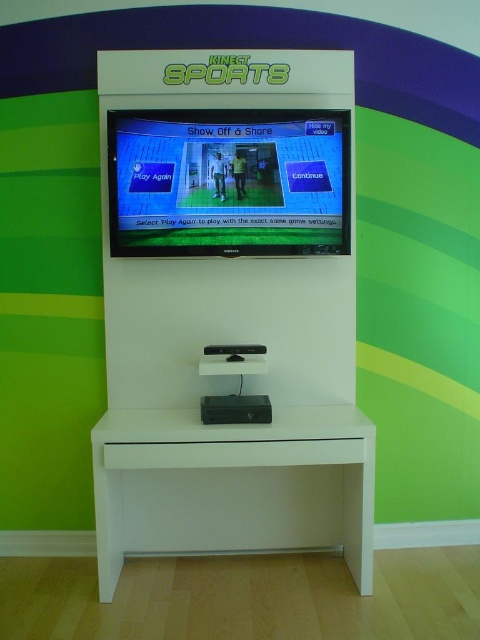
The width and height of the screenshot is (480, 640). In order to click on white glossy entertainment center at center in this screenshot , I will do `click(229, 308)`.

Can you confirm if white glossy entertainment center at center is wider than white matte table at center?

No, white glossy entertainment center at center is not wider than white matte table at center.

Find the location of `white glossy entertainment center at center`. white glossy entertainment center at center is located at coordinates (229, 308).

The height and width of the screenshot is (640, 480). What are the coordinates of `white glossy entertainment center at center` in the screenshot? It's located at (229, 308).

Does white matte table at center have a smaller size compared to matte black screen at center?

No.

Identify the location of white matte table at center. The image size is (480, 640). (232, 484).

This screenshot has width=480, height=640. What are the coordinates of `white matte table at center` in the screenshot? It's located at (232, 484).

Which is behind, point (278, 548) or point (134, 204)?

The point (278, 548) is more distant.

Does point (253, 397) come in front of point (324, 131)?

No, it is not.

Where is `white glossy entertainment center at center`? white glossy entertainment center at center is located at coordinates (229, 308).

Where is `white glossy entertainment center at center`? Image resolution: width=480 pixels, height=640 pixels. white glossy entertainment center at center is located at coordinates coord(229,308).